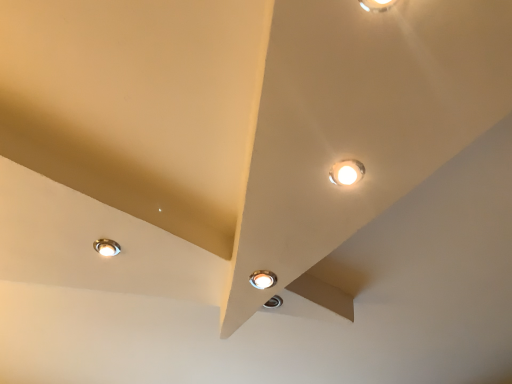
The image size is (512, 384). Describe the element at coordinates (106, 247) in the screenshot. I see `matte silver lamp at lower left, positioned as the 3th lamp in right-to-left order` at that location.

Locate an element on the screen. This screenshot has width=512, height=384. matte silver lamp at center, which is the second lamp from right to left is located at coordinates (263, 279).

This screenshot has width=512, height=384. What are the coordinates of `matte silver lamp at lower left, which appears as the first lamp when viewed from the back` in the screenshot? It's located at (106, 247).

Can we say matte silver lamp at center, acting as the first lamp starting from the bottom, lies outside matte white lamp at upper right, arranged as the 1th lamp when viewed from the top?

Yes, matte silver lamp at center, acting as the first lamp starting from the bottom, is outside of matte white lamp at upper right, arranged as the 1th lamp when viewed from the top.

From the picture: Can you tell me how much matte silver lamp at center, positioned as the second lamp in left-to-right order, and matte white lamp at upper right, arranged as the 1th lamp when viewed from the right, differ in facing direction?

matte silver lamp at center, positioned as the second lamp in left-to-right order, and matte white lamp at upper right, arranged as the 1th lamp when viewed from the right, are facing 91.1 degrees away from each other.

Between matte silver lamp at center, the 3th lamp viewed from the top, and matte white lamp at upper right, arranged as the third lamp when viewed from the back, which one has smaller width?

matte white lamp at upper right, arranged as the third lamp when viewed from the back, is thinner.

Does point (256, 287) come in front of point (357, 161)?

No, it is not.

Is matte silver lamp at lower left, which appears as the first lamp when viewed from the back, aimed at matte silver lamp at center, acting as the second lamp starting from the front?

No, matte silver lamp at lower left, which appears as the first lamp when viewed from the back, is not turned towards matte silver lamp at center, acting as the second lamp starting from the front.

Which of these two, matte silver lamp at lower left, which is the 1th lamp from left to right, or matte silver lamp at center, acting as the second lamp starting from the front, is smaller?

matte silver lamp at center, acting as the second lamp starting from the front.

Based on the photo, is matte silver lamp at lower left, the 2th lamp positioned from the bottom, touching matte silver lamp at center, which is the second lamp from right to left?

No, matte silver lamp at lower left, the 2th lamp positioned from the bottom, is not touching matte silver lamp at center, which is the second lamp from right to left.

Considering the relative sizes of matte silver lamp at lower left, positioned as the 3th lamp in right-to-left order, and matte silver lamp at center, which is the second lamp in back-to-front order, in the image provided, is matte silver lamp at lower left, positioned as the 3th lamp in right-to-left order, thinner than matte silver lamp at center, which is the second lamp in back-to-front order,?

Incorrect, the width of matte silver lamp at lower left, positioned as the 3th lamp in right-to-left order, is not less than that of matte silver lamp at center, which is the second lamp in back-to-front order.

Is matte white lamp at upper right, the first lamp positioned from the front, not near matte silver lamp at lower left, which appears as the first lamp when viewed from the back?

No, there isn't a large distance between matte white lamp at upper right, the first lamp positioned from the front, and matte silver lamp at lower left, which appears as the first lamp when viewed from the back.

From a real-world perspective, between matte white lamp at upper right, the 3th lamp when ordered from left to right, and matte silver lamp at lower left, the 2th lamp positioned from the top, who is vertically lower?

matte white lamp at upper right, the 3th lamp when ordered from left to right, from a real-world perspective.

Can you confirm if matte white lamp at upper right, arranged as the 1th lamp when viewed from the top, is smaller than matte silver lamp at lower left, the 2th lamp positioned from the bottom?

Yes, matte white lamp at upper right, arranged as the 1th lamp when viewed from the top, is smaller than matte silver lamp at lower left, the 2th lamp positioned from the bottom.

Is matte white lamp at upper right, arranged as the 1th lamp when viewed from the top, positioned with its back to matte silver lamp at center, acting as the second lamp starting from the front?

That's not correct — matte white lamp at upper right, arranged as the 1th lamp when viewed from the top, is not looking away from matte silver lamp at center, acting as the second lamp starting from the front.

From the image's perspective, is matte white lamp at upper right, placed as the third lamp when sorted from bottom to top, located above or below matte silver lamp at center, which is the second lamp in back-to-front order?

matte white lamp at upper right, placed as the third lamp when sorted from bottom to top, is situated higher than matte silver lamp at center, which is the second lamp in back-to-front order, in the image.

Is matte silver lamp at center, which is the second lamp from right to left, completely or partially inside matte white lamp at upper right, the 3th lamp when ordered from left to right?

No, matte silver lamp at center, which is the second lamp from right to left, is located outside of matte white lamp at upper right, the 3th lamp when ordered from left to right.

Consider the image. Considering the relative positions of matte white lamp at upper right, arranged as the 1th lamp when viewed from the top, and matte silver lamp at center, acting as the second lamp starting from the front, in the image provided, is matte white lamp at upper right, arranged as the 1th lamp when viewed from the top, in front of matte silver lamp at center, acting as the second lamp starting from the front,?

Yes.

Who is bigger, matte silver lamp at lower left, the 2th lamp positioned from the bottom, or matte white lamp at upper right, arranged as the 1th lamp when viewed from the top?

With larger size is matte silver lamp at lower left, the 2th lamp positioned from the bottom.

Is matte silver lamp at lower left, which appears as the first lamp when viewed from the back, in contact with matte white lamp at upper right, arranged as the third lamp when viewed from the back?

No, matte silver lamp at lower left, which appears as the first lamp when viewed from the back, is not making contact with matte white lamp at upper right, arranged as the third lamp when viewed from the back.

Considering the relative positions of matte silver lamp at lower left, the third lamp positioned from the front, and matte white lamp at upper right, arranged as the 1th lamp when viewed from the right, in the image provided, is matte silver lamp at lower left, the third lamp positioned from the front, to the left or to the right of matte white lamp at upper right, arranged as the 1th lamp when viewed from the right,?

From the image, it's evident that matte silver lamp at lower left, the third lamp positioned from the front, is to the left of matte white lamp at upper right, arranged as the 1th lamp when viewed from the right.

Which of these two, matte silver lamp at lower left, the 2th lamp positioned from the bottom, or matte white lamp at upper right, arranged as the 1th lamp when viewed from the top, is thinner?

With smaller width is matte white lamp at upper right, arranged as the 1th lamp when viewed from the top.

Is matte silver lamp at center, acting as the first lamp starting from the bottom, taller than matte silver lamp at lower left, which is the 1th lamp from left to right?

No.

Could you tell me if matte silver lamp at center, which is the second lamp in back-to-front order, is turned towards matte silver lamp at lower left, the 2th lamp positioned from the bottom?

No, matte silver lamp at center, which is the second lamp in back-to-front order, is not facing towards matte silver lamp at lower left, the 2th lamp positioned from the bottom.

Does matte silver lamp at center, which is the second lamp from right to left, contain matte silver lamp at lower left, the 2th lamp positioned from the top?

Definitely not — matte silver lamp at lower left, the 2th lamp positioned from the top, is not inside matte silver lamp at center, which is the second lamp from right to left.

Locate an element on the screen. Image resolution: width=512 pixels, height=384 pixels. the 1st lamp behind the matte white lamp at upper right, arranged as the 1th lamp when viewed from the top is located at coordinates (263, 279).

From a real-world perspective, which lamp is the 2nd one underneath the matte silver lamp at lower left, which is the 1th lamp from left to right? Please provide its 2D coordinates.

[(263, 279)]

From the image, which object appears to be nearer to matte silver lamp at center, positioned as the second lamp in left-to-right order, matte silver lamp at lower left, which is the 1th lamp from left to right, or matte white lamp at upper right, the first lamp positioned from the front?

The object closer to matte silver lamp at center, positioned as the second lamp in left-to-right order, is matte white lamp at upper right, the first lamp positioned from the front.

Looking at the image, which one is located closer to matte white lamp at upper right, arranged as the 1th lamp when viewed from the right, matte silver lamp at lower left, positioned as the 3th lamp in right-to-left order, or matte silver lamp at center, which is the second lamp from right to left?

matte silver lamp at center, which is the second lamp from right to left.

Based on their spatial positions, is matte white lamp at upper right, arranged as the third lamp when viewed from the back, or matte silver lamp at center, which is the second lamp from right to left, further from matte silver lamp at lower left, the 2th lamp positioned from the bottom?

Among the two, matte white lamp at upper right, arranged as the third lamp when viewed from the back, is located further to matte silver lamp at lower left, the 2th lamp positioned from the bottom.

Which object lies nearer to the anchor point matte white lamp at upper right, arranged as the 1th lamp when viewed from the top, matte silver lamp at center, which is the second lamp from right to left, or matte silver lamp at lower left, the 2th lamp positioned from the bottom?

Based on the image, matte silver lamp at center, which is the second lamp from right to left, appears to be nearer to matte white lamp at upper right, arranged as the 1th lamp when viewed from the top.

Considering their positions, is matte silver lamp at center, which is the second lamp in back-to-front order, positioned closer to matte silver lamp at lower left, which appears as the first lamp when viewed from the back, than matte white lamp at upper right, arranged as the 1th lamp when viewed from the top?

matte silver lamp at center, which is the second lamp in back-to-front order, is positioned closer to the anchor matte silver lamp at lower left, which appears as the first lamp when viewed from the back.

When comparing their distances from matte silver lamp at center, acting as the second lamp starting from the front, does matte white lamp at upper right, the 3th lamp when ordered from left to right, or matte silver lamp at lower left, the 2th lamp positioned from the top, seem closer?

matte white lamp at upper right, the 3th lamp when ordered from left to right, is closer to matte silver lamp at center, acting as the second lamp starting from the front.

The height and width of the screenshot is (384, 512). What are the coordinates of `lamp located between matte silver lamp at lower left, the third lamp positioned from the front, and matte white lamp at upper right, arranged as the 1th lamp when viewed from the top, in the left-right direction` in the screenshot? It's located at pos(263,279).